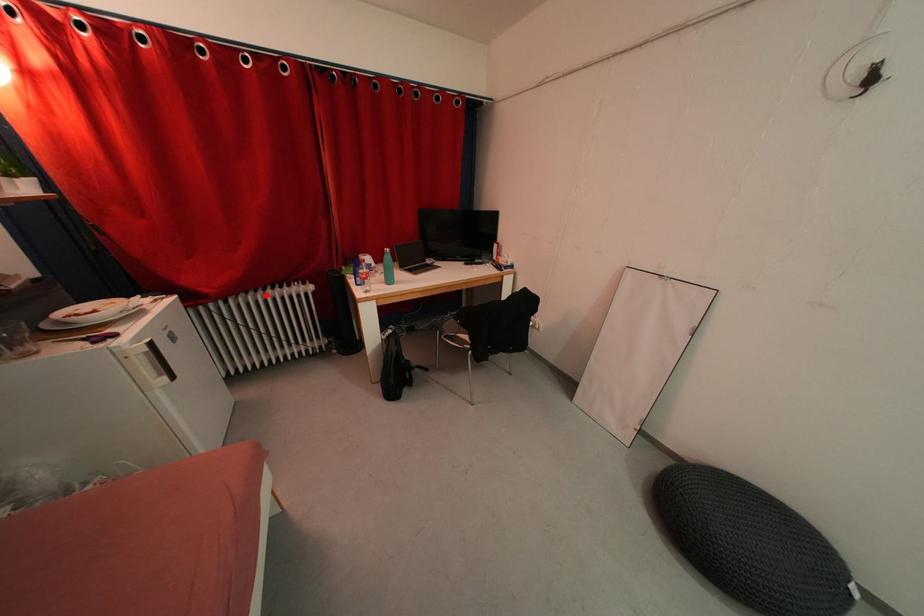
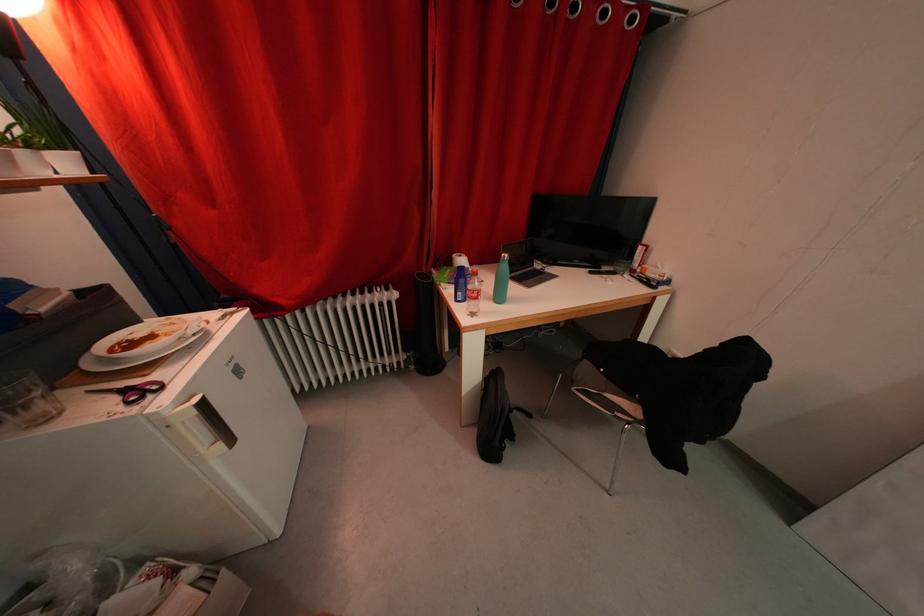
In the second image, find the point that corresponds to the highlighted location in the first image.

(346, 302)